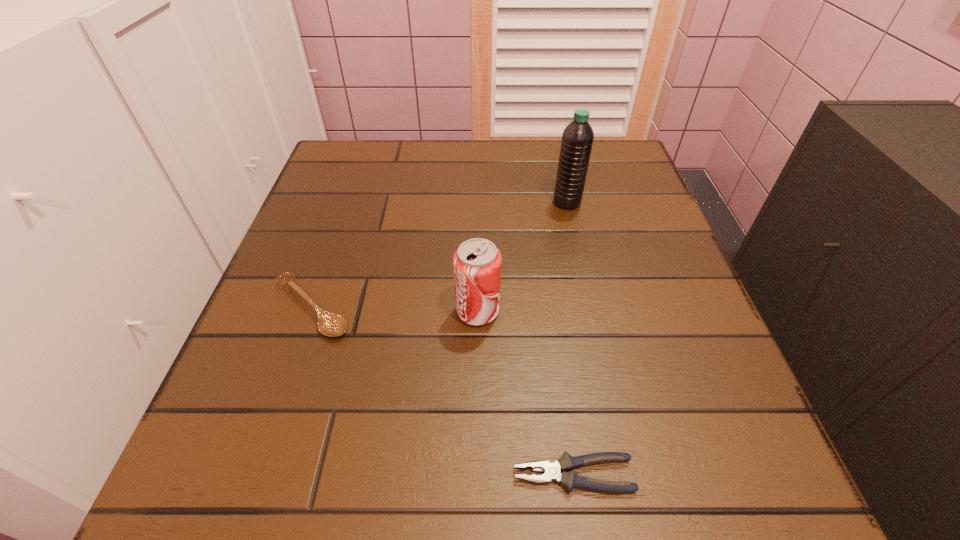
Find the location of a particular element. The image size is (960, 540). vacant point located 0.180m on the back of the ladle is located at coordinates (343, 217).

Locate an element on the screen. This screenshot has height=540, width=960. free space located at the gripping part of the nearest object is located at coordinates (373, 475).

Find the location of a particular element. vacant space located at the gripping part of the nearest object is located at coordinates (413, 475).

Locate an element on the screen. The image size is (960, 540). free space located at the gripping part of the nearest object is located at coordinates (342, 475).

Identify the location of object that is positioned at the far edge. (577, 139).

This screenshot has height=540, width=960. In order to click on object at the near edge in this screenshot , I will do `click(552, 471)`.

Where is `object present at the left edge`? This screenshot has height=540, width=960. object present at the left edge is located at coordinates (330, 324).

Locate an element on the screen. object that is at the right edge is located at coordinates (577, 139).

The width and height of the screenshot is (960, 540). I want to click on object at the far right corner, so click(577, 139).

The image size is (960, 540). In the image, there is a desktop. Identify the location of vacant space at the far edge. (465, 184).